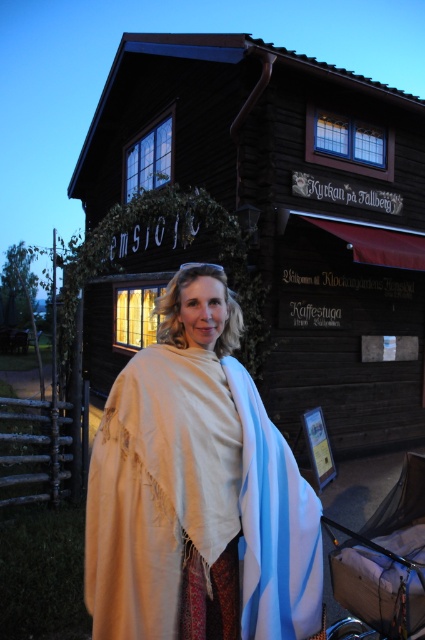
You are standing at the entrance of the brown wooden cabin at center. From your current position, in which direction would you look to see the illuminated windows?

The brown wooden cabin at center has illuminated windows, so you would look towards the windows on the building to see them, which are part of the cabin structure itself.

You are a photographer trying to capture the woman and the baby carriage in the scene. Since the beige wool shawl at center and the brown fabric baby carriage at lower right are in the frame, which object will appear larger in your photo?

The beige wool shawl at center will appear larger in the photo because it is taller than the brown fabric baby carriage at lower right.